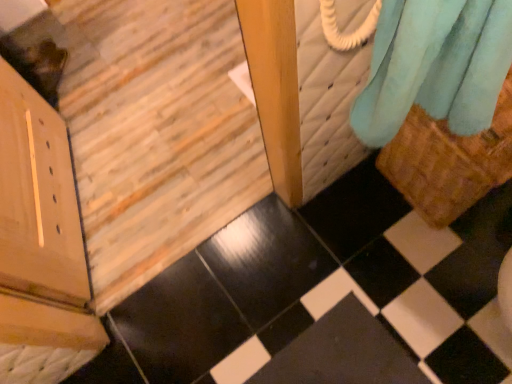
What do you see at coordinates (155, 132) in the screenshot?
I see `wooden door at lower left` at bounding box center [155, 132].

In order to face wooden door at lower left, should I rotate leftwards or rightwards?

A 14.992 degree turn to the left will do.

I want to click on black glossy tile at lower right, so click(x=342, y=353).

Where is `wooden door at lower left`? This screenshot has width=512, height=384. wooden door at lower left is located at coordinates coord(155,132).

From the picture: Would you say black glossy tile at lower right is part of wooden door at lower left's contents?

No, black glossy tile at lower right is not inside wooden door at lower left.

What's the angular difference between wooden door at lower left and black glossy tile at lower right's facing directions?

wooden door at lower left and black glossy tile at lower right are facing 177 degrees away from each other.

Is wooden door at lower left smaller than black glossy tile at lower right?

No, wooden door at lower left is not smaller than black glossy tile at lower right.

From the picture: Between soft blue fabric at upper right and black glossy tile at lower right, which one has less height?

black glossy tile at lower right is shorter.

Is point (470, 104) closer to camera compared to point (355, 333)?

Yes, point (470, 104) is in front of point (355, 333).

Is soft blue fabric at upper right next to black glossy tile at lower right?

No, soft blue fabric at upper right is not in contact with black glossy tile at lower right.

Is black glossy tile at lower right turned away from wooden door at lower left?

No, black glossy tile at lower right is not facing away from wooden door at lower left.

How many degrees apart are the facing directions of black glossy tile at lower right and wooden door at lower left?

They differ by 177 degrees in their facing directions.

Identify the location of square that appears on the right of wooden door at lower left. This screenshot has width=512, height=384. (342, 353).

Consider the image. Is black glossy tile at lower right spatially inside wooden door at lower left, or outside of it?

black glossy tile at lower right lies outside wooden door at lower left.

Is black glossy tile at lower right with soft blue fabric at upper right?

No, black glossy tile at lower right is not beside soft blue fabric at upper right.

Based on the photo, is black glossy tile at lower right positioned with its back to soft blue fabric at upper right?

That's not correct — black glossy tile at lower right is not looking away from soft blue fabric at upper right.

Which is less distant, (153, 80) or (365, 107)?

Positioned in front is point (365, 107).

Which object is further away from the camera, wooden door at lower left or soft blue fabric at upper right?

soft blue fabric at upper right is more distant.

Does wooden door at lower left turn towards soft blue fabric at upper right?

No, wooden door at lower left does not turn towards soft blue fabric at upper right.

Considering the relative sizes of wooden door at lower left and soft blue fabric at upper right in the image provided, is wooden door at lower left bigger than soft blue fabric at upper right?

Indeed, wooden door at lower left has a larger size compared to soft blue fabric at upper right.

Is soft blue fabric at upper right in front of wooden door at lower left?

No.

Between soft blue fabric at upper right and wooden door at lower left, which one has smaller size?

soft blue fabric at upper right is smaller.

Is point (456, 49) in front of point (175, 10)?

Yes, it is in front of point (175, 10).

I want to click on stairwell that is on the left side of soft blue fabric at upper right, so click(x=155, y=132).

The height and width of the screenshot is (384, 512). What are the coordinates of `square behind the wooden door at lower left` in the screenshot? It's located at (342, 353).

Where is `curtain above the black glossy tile at lower right (from a real-world perspective)`? The height and width of the screenshot is (384, 512). curtain above the black glossy tile at lower right (from a real-world perspective) is located at coordinates (435, 66).

Which object lies further to the anchor point soft blue fabric at upper right, black glossy tile at lower right or wooden door at lower left?

Based on the image, wooden door at lower left appears to be further to soft blue fabric at upper right.

From the image, which object appears to be farther from wooden door at lower left, black glossy tile at lower right or soft blue fabric at upper right?

soft blue fabric at upper right is further to wooden door at lower left.

Estimate the real-world distances between objects in this image. Which object is further from black glossy tile at lower right, soft blue fabric at upper right or wooden door at lower left?

wooden door at lower left.

Based on their spatial positions, is soft blue fabric at upper right or black glossy tile at lower right closer to wooden door at lower left?

black glossy tile at lower right is positioned closer to the anchor wooden door at lower left.

Which object lies further to the anchor point soft blue fabric at upper right, wooden door at lower left or black glossy tile at lower right?

wooden door at lower left.

Which object lies nearer to the anchor point black glossy tile at lower right, wooden door at lower left or soft blue fabric at upper right?

The object closer to black glossy tile at lower right is soft blue fabric at upper right.

At what (x,y) coordinates should I click in order to perform the action: click on curtain between wooden door at lower left and black glossy tile at lower right along the z-axis. Please return your answer as a coordinate pair (x, y). The image size is (512, 384). Looking at the image, I should click on (435, 66).